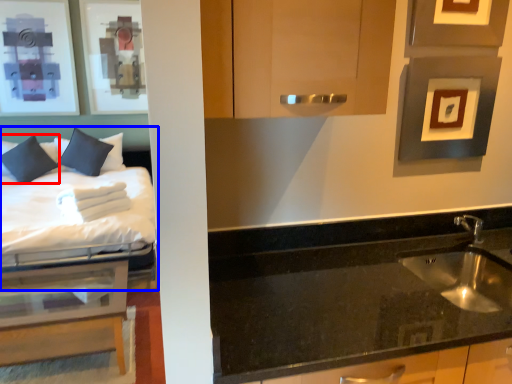
Question: Which object appears closest to the camera in this image, pillow (highlighted by a red box) or bed (highlighted by a blue box)?

Choices:
 (A) pillow
 (B) bed

Answer: (B)